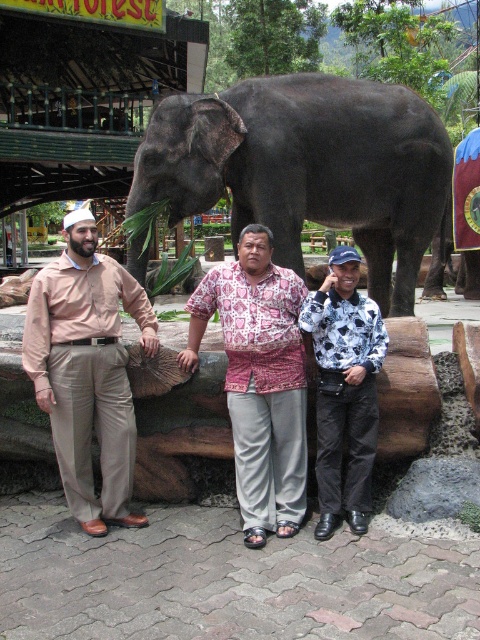
Question: Which of these objects is positioned closest to the dark gray elephant at center?

Choices:
 (A) matte beige pants at left
 (B) printed fabric shirt at center

Answer: (B)

Question: Does dark gray elephant at center appear over printed fabric shirt at center?

Choices:
 (A) yes
 (B) no

Answer: (A)

Question: Which of the following is the farthest from the observer?

Choices:
 (A) (448, 177)
 (B) (369, 508)
 (C) (227, 314)

Answer: (A)

Question: Is matte beige pants at left below printed fabric shirt at center?

Choices:
 (A) yes
 (B) no

Answer: (B)

Question: Which point is farther to the camera?

Choices:
 (A) (257, 259)
 (B) (130, 492)
 (C) (223, 186)
 (D) (361, 458)

Answer: (C)

Question: Can you confirm if dark gray elephant at center is smaller than white printed shirt at center?

Choices:
 (A) yes
 (B) no

Answer: (B)